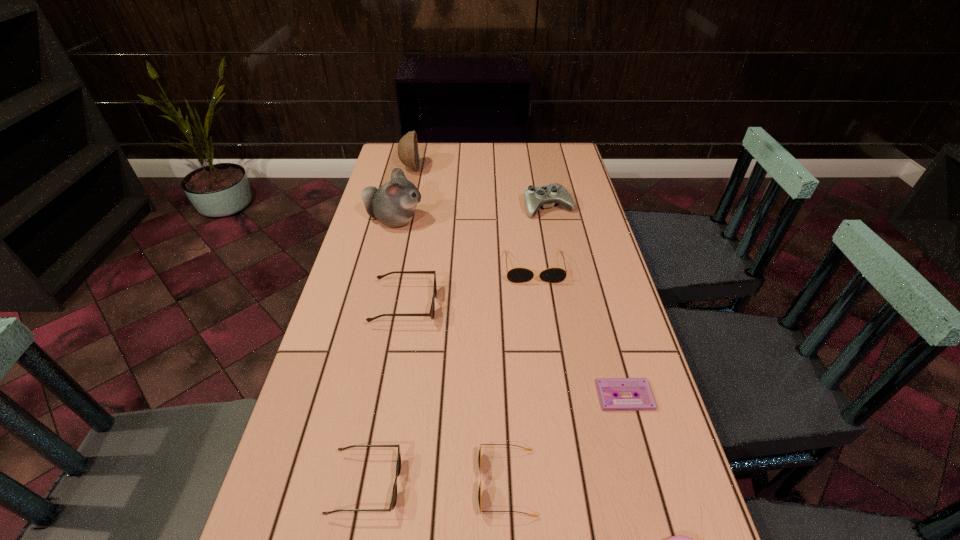
The width and height of the screenshot is (960, 540). Identify the location of free location that satisfies the following two spatial constraints: 1. on the front-facing side of the farther black sunglasses; 2. on the front lenses of the smaller brown sunglasses. (563, 484).

Find the location of `free spot that satisfies the following two spatial constraints: 1. on the front side of the farthest object; 2. on the right side of the third tallest object`. free spot that satisfies the following two spatial constraints: 1. on the front side of the farthest object; 2. on the right side of the third tallest object is located at coordinates (401, 207).

At what (x,y) coordinates should I click in order to perform the action: click on blank area in the image that satisfies the following two spatial constraints: 1. on the face of the white hamster; 2. on the left side of the sixth farthest object. Please return your answer as a coordinate pair (x, y). The width and height of the screenshot is (960, 540). Looking at the image, I should click on (353, 396).

Where is `blank area in the image that satisfies the following two spatial constraints: 1. on the front lenses of the farther brown sunglasses; 2. on the left side of the videotape`? The height and width of the screenshot is (540, 960). blank area in the image that satisfies the following two spatial constraints: 1. on the front lenses of the farther brown sunglasses; 2. on the left side of the videotape is located at coordinates (389, 396).

Locate an element on the screen. This screenshot has width=960, height=540. vacant space that satisfies the following two spatial constraints: 1. on the front side of the shortest object; 2. on the front-facing side of the nearer black sunglasses is located at coordinates (648, 483).